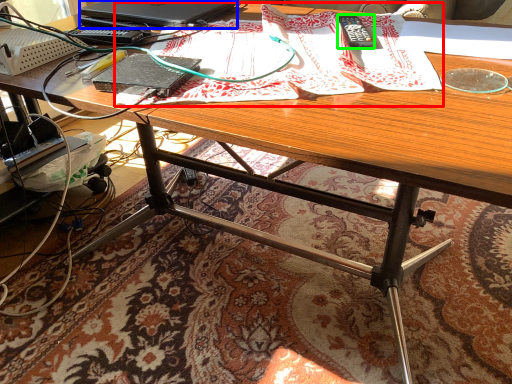
Question: Which object is the closest to the wrapping paper (highlighted by a red box)? Choose among these: laptop (highlighted by a blue box) or remote control (highlighted by a green box).

Choices:
 (A) laptop
 (B) remote control

Answer: (B)